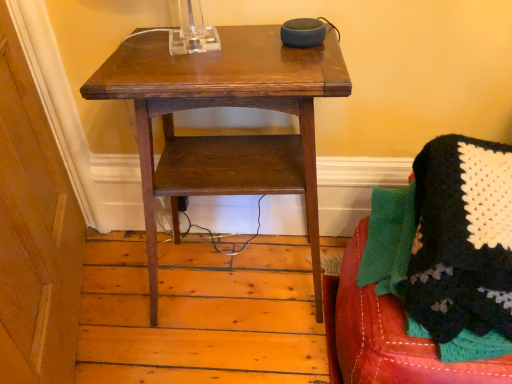
What are the coordinates of `knitted fabric blanket at lower right` in the screenshot? It's located at (433, 273).

The height and width of the screenshot is (384, 512). Describe the element at coordinates (433, 273) in the screenshot. I see `knitted fabric blanket at lower right` at that location.

Where is `wooden table at center`? This screenshot has width=512, height=384. wooden table at center is located at coordinates (224, 136).

Describe the element at coordinates (224, 136) in the screenshot. I see `wooden table at center` at that location.

Find the location of a particular element. knitted fabric blanket at lower right is located at coordinates (433, 273).

Based on their positions, is wooden table at center located to the left or right of knitted fabric blanket at lower right?

Clearly, wooden table at center is on the left of knitted fabric blanket at lower right in the image.

Which object is further away from the camera, wooden table at center or knitted fabric blanket at lower right?

wooden table at center is further from the camera.

Does point (292, 88) appear closer or farther from the camera than point (455, 285)?

Point (292, 88) is farther from the camera than point (455, 285).

From the image's perspective, is wooden table at center located above or below knitted fabric blanket at lower right?

Based on their image positions, wooden table at center is located above knitted fabric blanket at lower right.

From a real-world perspective, is wooden table at center physically located above or below knitted fabric blanket at lower right?

Clearly, from a real-world perspective, wooden table at center is below knitted fabric blanket at lower right.

Does wooden table at center have a lesser width compared to knitted fabric blanket at lower right?

Correct, the width of wooden table at center is less than that of knitted fabric blanket at lower right.

Is wooden table at center taller or shorter than knitted fabric blanket at lower right?

Considering their sizes, wooden table at center has more height than knitted fabric blanket at lower right.

Is wooden table at center smaller than knitted fabric blanket at lower right?

Incorrect, wooden table at center is not smaller in size than knitted fabric blanket at lower right.

Could knitted fabric blanket at lower right be considered to be inside wooden table at center?

Actually, knitted fabric blanket at lower right is outside wooden table at center.

In the scene shown: Is wooden table at center in contact with knitted fabric blanket at lower right?

No, wooden table at center is not with knitted fabric blanket at lower right.

Could you tell me if wooden table at center is turned towards knitted fabric blanket at lower right?

No, wooden table at center is not turned towards knitted fabric blanket at lower right.

Identify the location of table lying behind the knitted fabric blanket at lower right. This screenshot has width=512, height=384. (224, 136).

Based on the photo, does knitted fabric blanket at lower right appear on the right side of wooden table at center?

Indeed, knitted fabric blanket at lower right is positioned on the right side of wooden table at center.

Is knitted fabric blanket at lower right positioned before wooden table at center?

Yes, knitted fabric blanket at lower right is closer to the viewer.

Considering the points (406, 286) and (184, 160), which point is behind, point (406, 286) or point (184, 160)?

Positioned behind is point (184, 160).

From the image's perspective, who appears lower, knitted fabric blanket at lower right or wooden table at center?

knitted fabric blanket at lower right.

From a real-world perspective, is knitted fabric blanket at lower right positioned above or below wooden table at center?

In terms of real-world spatial position, knitted fabric blanket at lower right is above wooden table at center.

Looking at their sizes, would you say knitted fabric blanket at lower right is wider or thinner than wooden table at center?

knitted fabric blanket at lower right is wider than wooden table at center.

Can you confirm if knitted fabric blanket at lower right is shorter than wooden table at center?

Correct, knitted fabric blanket at lower right is not as tall as wooden table at center.

Who is smaller, knitted fabric blanket at lower right or wooden table at center?

knitted fabric blanket at lower right is smaller.

Is knitted fabric blanket at lower right not within wooden table at center?

That's correct, knitted fabric blanket at lower right is outside of wooden table at center.

Is knitted fabric blanket at lower right not close to wooden table at center?

No, knitted fabric blanket at lower right is in close proximity to wooden table at center.

Could you tell me if knitted fabric blanket at lower right is facing wooden table at center?

No, knitted fabric blanket at lower right is not oriented towards wooden table at center.

This screenshot has height=384, width=512. Identify the location of table on the left of knitted fabric blanket at lower right. (224, 136).

Where is `furniture above the wooden table at center (from a real-world perspective)`? Image resolution: width=512 pixels, height=384 pixels. furniture above the wooden table at center (from a real-world perspective) is located at coordinates (433, 273).

I want to click on table below the knitted fabric blanket at lower right (from a real-world perspective), so click(x=224, y=136).